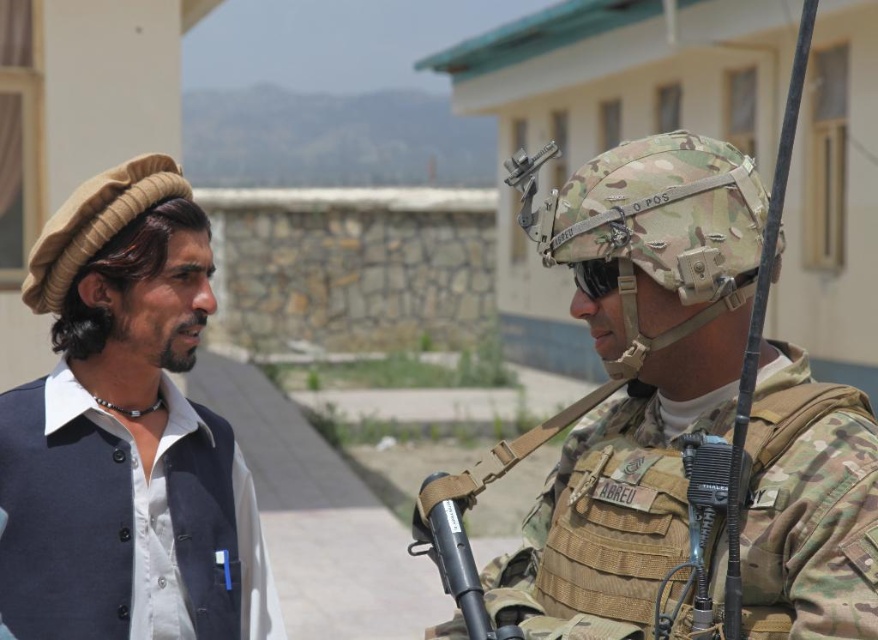
Is the position of camouflage fabric helmet at center less distant than that of dark blue fabric shirt at left?

Yes, it is in front of dark blue fabric shirt at left.

Describe the element at coordinates (635, 376) in the screenshot. This screenshot has height=640, width=878. I see `camouflage fabric helmet at center` at that location.

Who is more forward, (724, 266) or (99, 304)?

Point (724, 266) is in front.

Find the location of a particular element. camouflage fabric helmet at center is located at coordinates (635, 376).